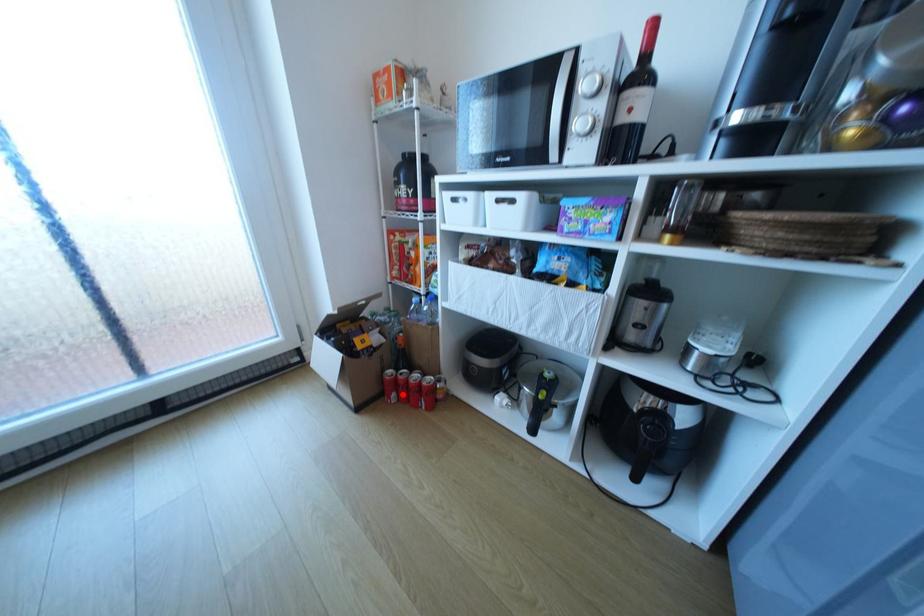
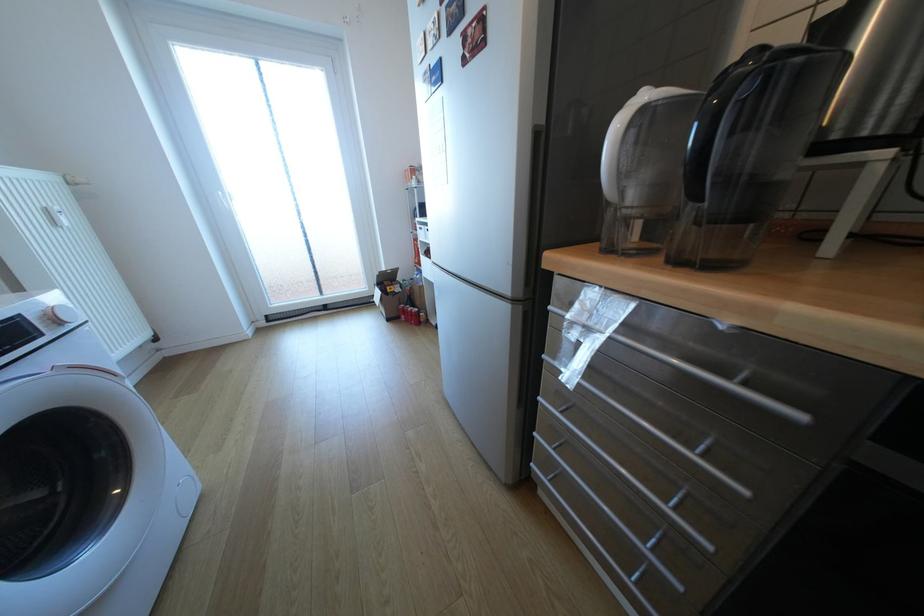
The point at the highlighted location is marked in the first image. Where is the corresponding point in the second image?

(411, 315)